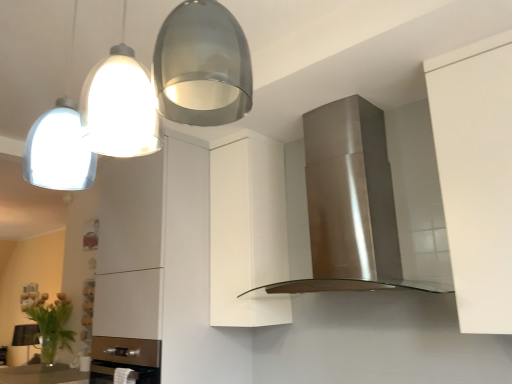
Question: Looking at the image, does white matte cabinet at center seem bigger or smaller compared to satin silver pendant lights at upper left?

Choices:
 (A) small
 (B) big

Answer: (A)

Question: In the image, is white matte cabinet at center on the left side or the right side of satin silver pendant lights at upper left?

Choices:
 (A) left
 (B) right

Answer: (B)

Question: Based on their relative distances, which object is nearer to the stainless steel range hood at center?

Choices:
 (A) green leafy plant at lower left
 (B) satin silver pendant lights at upper left
 (C) white matte cabinet at center

Answer: (C)

Question: Which of these objects is positioned closest to the satin silver pendant lights at upper left?

Choices:
 (A) stainless steel range hood at center
 (B) green leafy plant at lower left
 (C) white matte cabinet at center

Answer: (A)